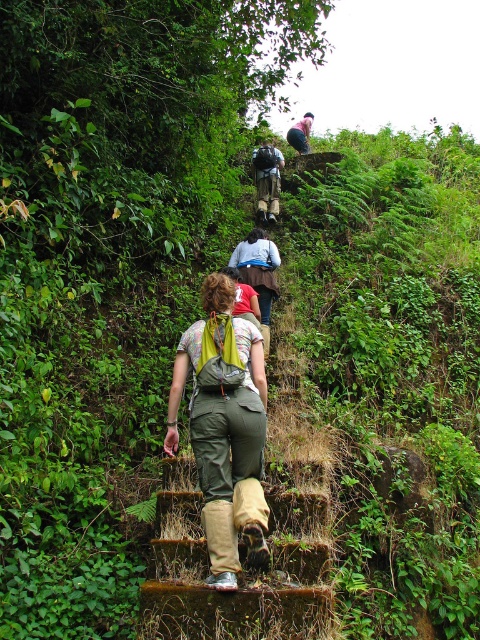
Is brown wood stairs at center shorter than matte khaki pants at center?

Yes, brown wood stairs at center is shorter than matte khaki pants at center.

Is brown wood stairs at center bigger than matte khaki pants at center?

Yes, brown wood stairs at center is bigger than matte khaki pants at center.

Is point (310, 512) in front of point (269, 160)?

Yes, point (310, 512) is closer to viewer.

Identify the location of brown wood stairs at center. The height and width of the screenshot is (640, 480). (243, 564).